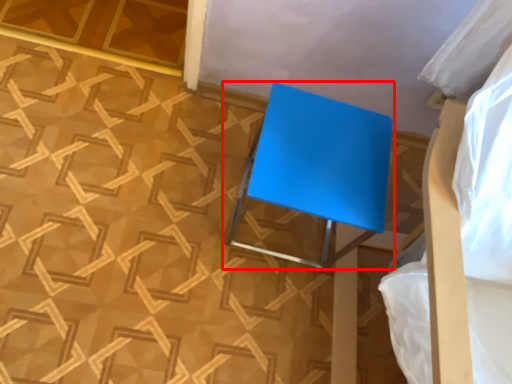
Question: In this image, where is furniture (annotated by the red box) located relative to bed?

Choices:
 (A) right
 (B) left

Answer: (B)